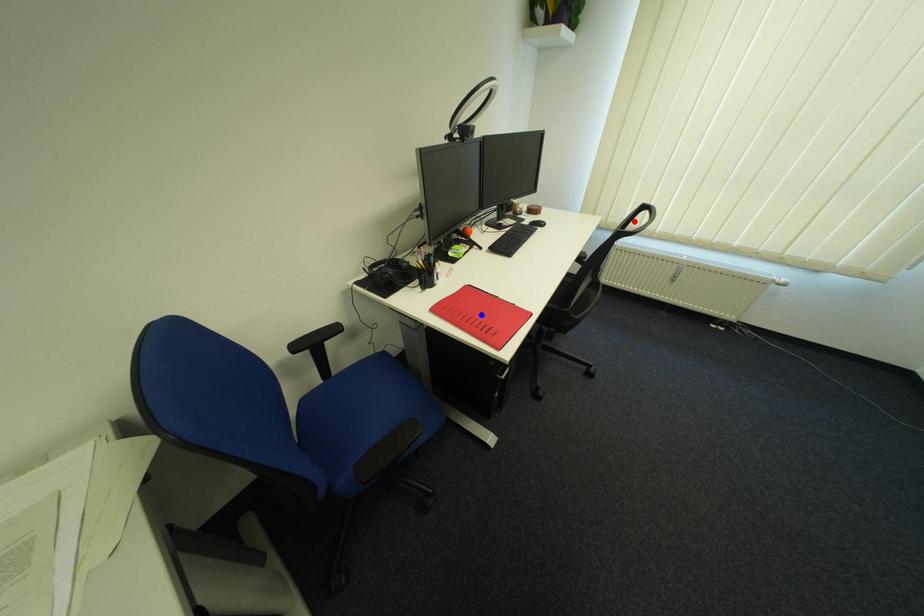
Question: Which of the two points in the image is closer to the camera?

Choices:
 (A) Blue point is closer.
 (B) Red point is closer.

Answer: (A)